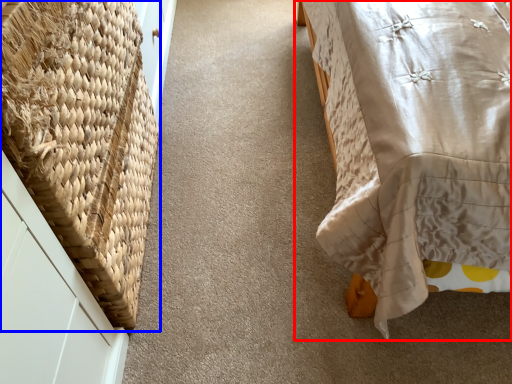
Question: Among these objects, which one is nearest to the camera, furniture (highlighted by a red box) or basket (highlighted by a blue box)?

Choices:
 (A) furniture
 (B) basket

Answer: (A)